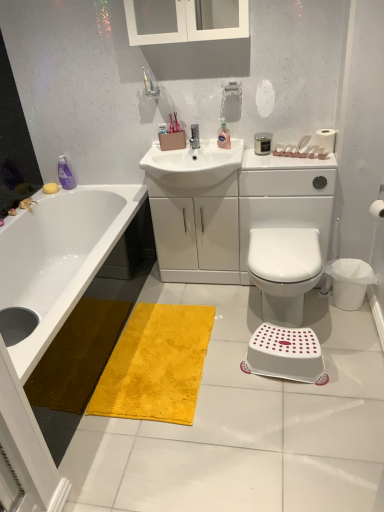
This screenshot has width=384, height=512. In order to click on vacant space in front of yellow plush rug at center in this screenshot , I will do `click(188, 450)`.